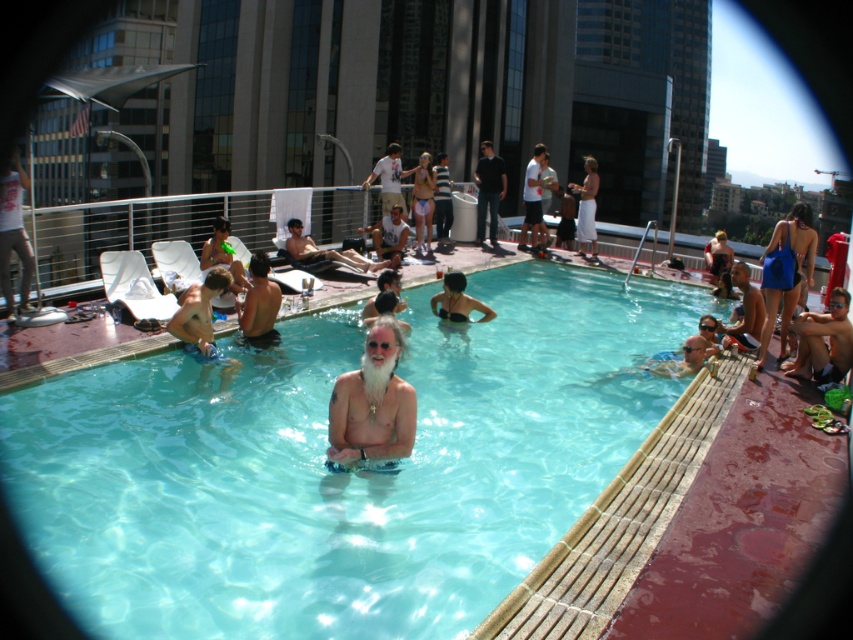
Question: Among these objects, which one is nearest to the camera?

Choices:
 (A) beige fabric shorts at center
 (B) smooth tan skin at center

Answer: (B)

Question: Does clear glass water at center have a lesser width compared to white cotton t-shirt at upper center?

Choices:
 (A) no
 (B) yes

Answer: (A)

Question: Is shiny black swim trunks at center positioned behind white cotton shorts at upper right?

Choices:
 (A) yes
 (B) no

Answer: (B)

Question: Estimate the real-world distances between objects in this image. Which object is farther from the clear glass water at center?

Choices:
 (A) beige fabric shorts at center
 (B) tan skin man at center
 (C) shiny black swim trunks at center

Answer: (A)

Question: Does tan skin man at center have a greater width compared to white cotton shorts at upper right?

Choices:
 (A) no
 (B) yes

Answer: (A)

Question: Which object is positioned farthest from the shiny black swim trunks at center?

Choices:
 (A) tan skin man at center
 (B) beige skin man at center
 (C) beige fabric shorts at center
 (D) dark blue jeans at center

Answer: (D)